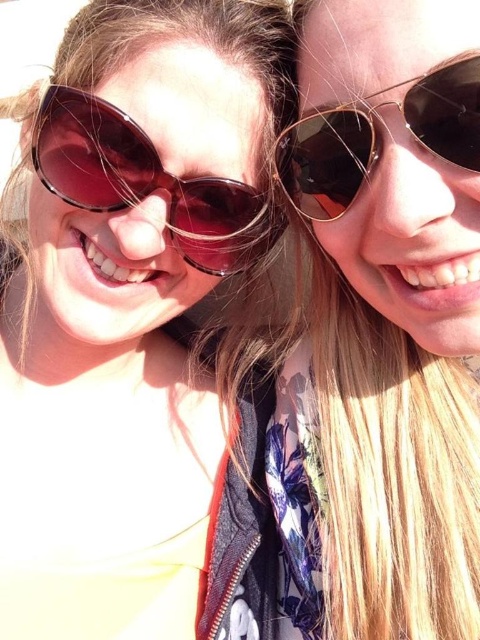
Question: Is matte black sunglasses at upper left positioned at the back of matte brown sunglasses at left?

Choices:
 (A) yes
 (B) no

Answer: (A)

Question: Among these points, which one is nearest to the camera?

Choices:
 (A) (316, 205)
 (B) (415, 252)
 (C) (202, 177)
 (D) (255, 204)

Answer: (B)

Question: Can you confirm if matte black sunglasses at upper left is positioned to the left of gold metallic sunglasses at upper right?

Choices:
 (A) no
 (B) yes

Answer: (B)

Question: Among these objects, which one is farthest from the camera?

Choices:
 (A) matte black sunglasses at right
 (B) matte brown sunglasses at left
 (C) gold metallic sunglasses at upper right
 (D) matte black sunglasses at upper left

Answer: (D)

Question: Considering the real-world distances, which object is closest to the gold metallic sunglasses at upper right?

Choices:
 (A) matte black sunglasses at right
 (B) matte black sunglasses at upper left

Answer: (A)

Question: Does matte black sunglasses at right have a larger size compared to matte brown sunglasses at left?

Choices:
 (A) yes
 (B) no

Answer: (A)